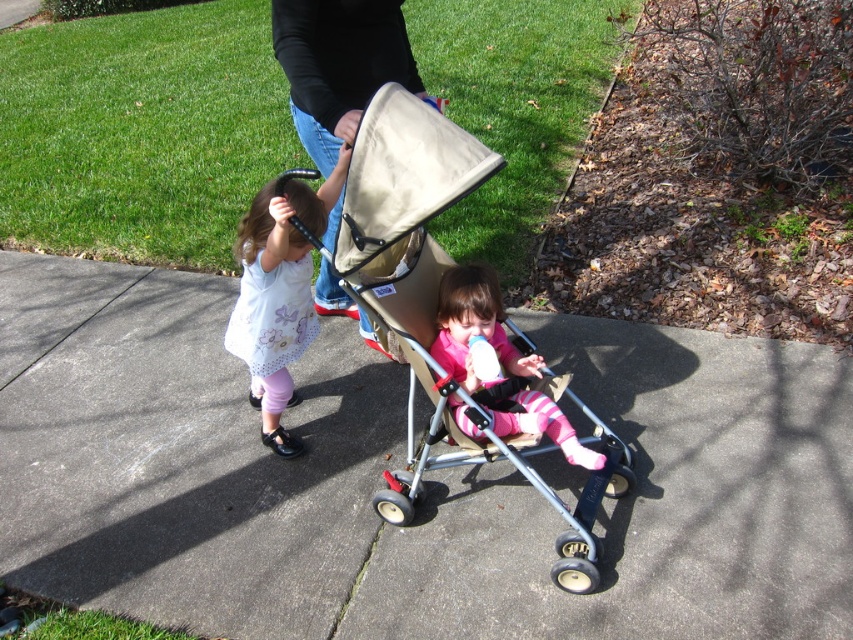
Question: Which point appears farthest from the camera in this image?

Choices:
 (A) (383, 118)
 (B) (236, 352)
 (C) (341, 36)

Answer: (B)

Question: From the image, what is the correct spatial relationship of beige fabric stroller at center in relation to white dotted dress at left?

Choices:
 (A) below
 (B) above

Answer: (A)

Question: Estimate the real-world distances between objects in this image. Which object is farther from the beige fabric stroller at center?

Choices:
 (A) gray concrete pavement at center
 (B) black fabric at upper center
 (C) white dotted dress at left

Answer: (A)

Question: Can you confirm if black fabric at upper center is positioned to the left of white dotted dress at left?

Choices:
 (A) no
 (B) yes

Answer: (A)

Question: Is gray concrete pavement at center positioned before beige fabric stroller at center?

Choices:
 (A) yes
 (B) no

Answer: (B)

Question: Which point is closer to the camera?

Choices:
 (A) black fabric at upper center
 (B) beige fabric stroller at center

Answer: (B)